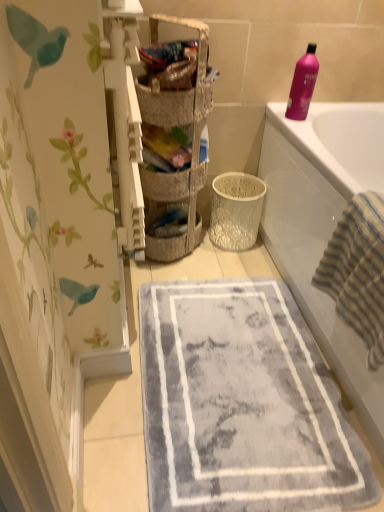
Question: Should I look upward or downward to see pink glossy bottle at upper right?

Choices:
 (A) up
 (B) down

Answer: (A)

Question: From the image's perspective, is woven basket at center on pink glossy bottle at upper right?

Choices:
 (A) no
 (B) yes

Answer: (A)

Question: Is pink glossy bottle at upper right at the back of woven basket at center?

Choices:
 (A) no
 (B) yes

Answer: (A)

Question: From the image's perspective, is woven basket at center located beneath pink glossy bottle at upper right?

Choices:
 (A) no
 (B) yes

Answer: (B)

Question: Does woven basket at center appear on the right side of pink glossy bottle at upper right?

Choices:
 (A) no
 (B) yes

Answer: (A)

Question: From a real-world perspective, is woven basket at center below pink glossy bottle at upper right?

Choices:
 (A) yes
 (B) no

Answer: (A)

Question: Is the depth of woven basket at center greater than that of pink glossy bottle at upper right?

Choices:
 (A) no
 (B) yes

Answer: (A)

Question: Can you confirm if woven fabric basket at upper center, placed as the second basket when sorted from back to front, is smaller than striped cotton beach towel at right?

Choices:
 (A) yes
 (B) no

Answer: (A)

Question: Is woven fabric basket at upper center, arranged as the 1th basket when viewed from the front, facing away from striped cotton beach towel at right?

Choices:
 (A) yes
 (B) no

Answer: (B)

Question: Could you tell me if woven fabric basket at upper center, arranged as the 1th basket when viewed from the front, is facing striped cotton beach towel at right?

Choices:
 (A) no
 (B) yes

Answer: (B)

Question: Is woven fabric basket at upper center, arranged as the 1th basket when viewed from the front, outside of striped cotton beach towel at right?

Choices:
 (A) yes
 (B) no

Answer: (A)

Question: Is woven fabric basket at upper center, placed as the second basket when sorted from back to front, to the right of striped cotton beach towel at right from the viewer's perspective?

Choices:
 (A) yes
 (B) no

Answer: (B)

Question: Is woven fabric basket at upper center, placed as the second basket when sorted from back to front, shorter than striped cotton beach towel at right?

Choices:
 (A) yes
 (B) no

Answer: (A)

Question: Can you confirm if textured wicker basket at center, which ranks as the 2th basket in front-to-back order, is shorter than woven fabric basket at upper center, placed as the second basket when sorted from back to front?

Choices:
 (A) yes
 (B) no

Answer: (A)